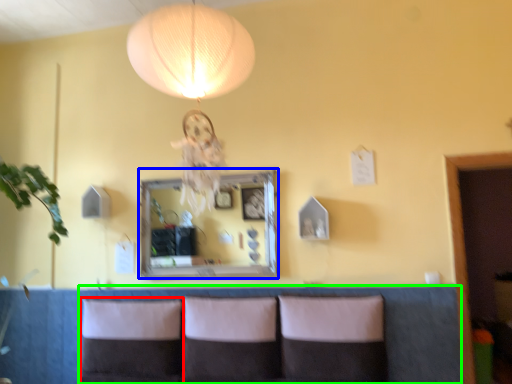
Question: Estimate the real-world distances between objects in this image. Which object is closer to pillow (highlighted by a red box), mirror (highlighted by a blue box) or couch (highlighted by a green box)?

Choices:
 (A) mirror
 (B) couch

Answer: (A)